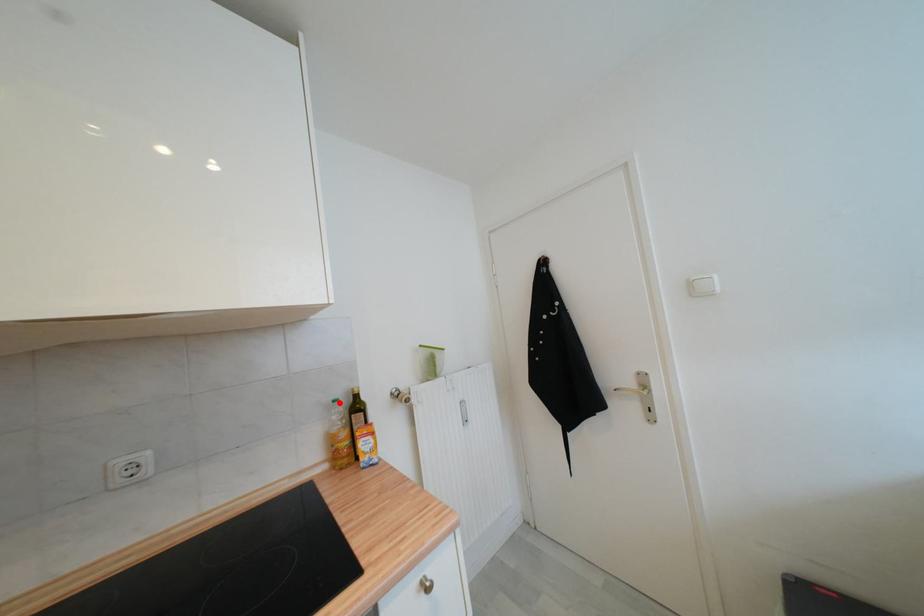
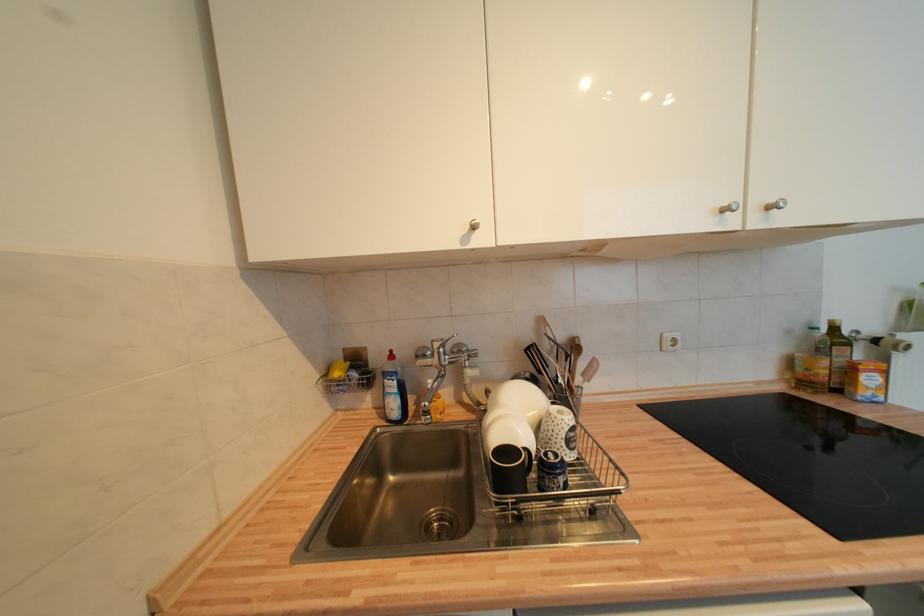
Find the pixel in the second image that matches the highlighted location in the first image.

(819, 331)